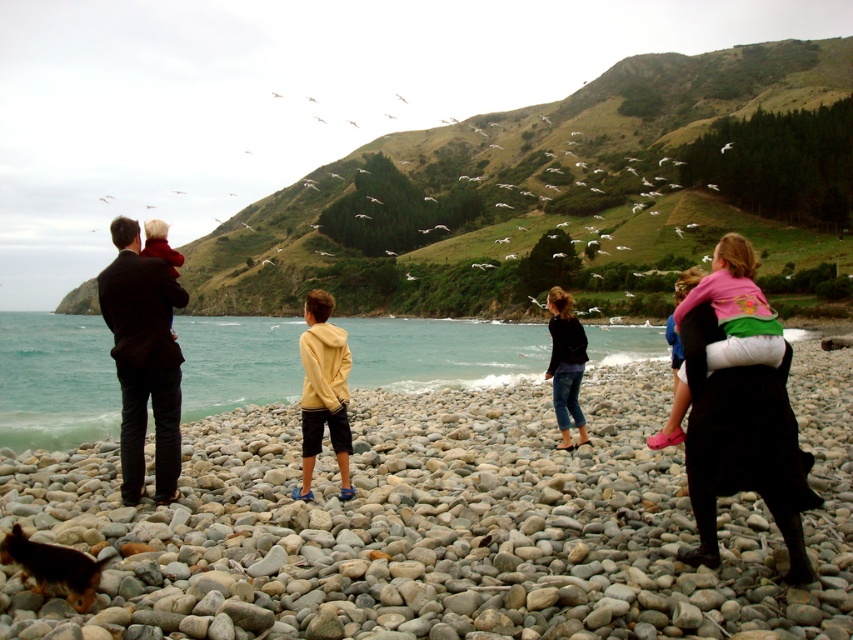
In the scene shown: Can you confirm if dark suit at left is wider than brown fur dog at lower left?

Correct, the width of dark suit at left exceeds that of brown fur dog at lower left.

Does dark suit at left have a smaller size compared to brown fur dog at lower left?

Incorrect, dark suit at left is not smaller in size than brown fur dog at lower left.

Who is more forward, (177, 413) or (85, 593)?

Point (85, 593) is in front.

Where is `dark suit at left`? This screenshot has height=640, width=853. dark suit at left is located at coordinates (143, 358).

From the picture: Between teal water at center and dark suit at left, which one has less height?

Standing shorter between the two is teal water at center.

Is teal water at center taller than dark suit at left?

Incorrect, teal water at center's height is not larger of dark suit at left's.

The height and width of the screenshot is (640, 853). In order to click on teal water at center in this screenshot , I will do `click(55, 380)`.

Locate an element on the screen. The width and height of the screenshot is (853, 640). teal water at center is located at coordinates coord(55,380).

Between yellow matte hoodie at center and brown fur dog at lower left, which one has more height?

yellow matte hoodie at center

The width and height of the screenshot is (853, 640). What do you see at coordinates (323, 390) in the screenshot?
I see `yellow matte hoodie at center` at bounding box center [323, 390].

At what (x,y) coordinates should I click in order to perform the action: click on yellow matte hoodie at center. Please return your answer as a coordinate pair (x, y). Looking at the image, I should click on (323, 390).